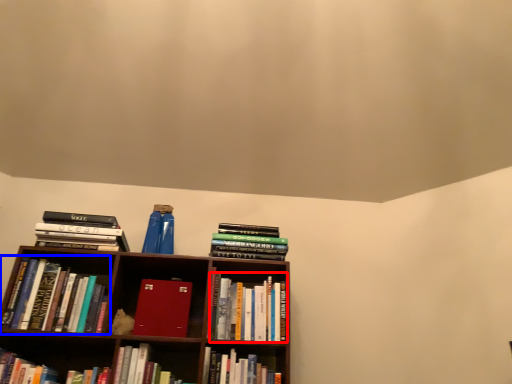
Question: Among these objects, which one is farthest to the camera, book (highlighted by a red box) or book (highlighted by a blue box)?

Choices:
 (A) book
 (B) book

Answer: (A)